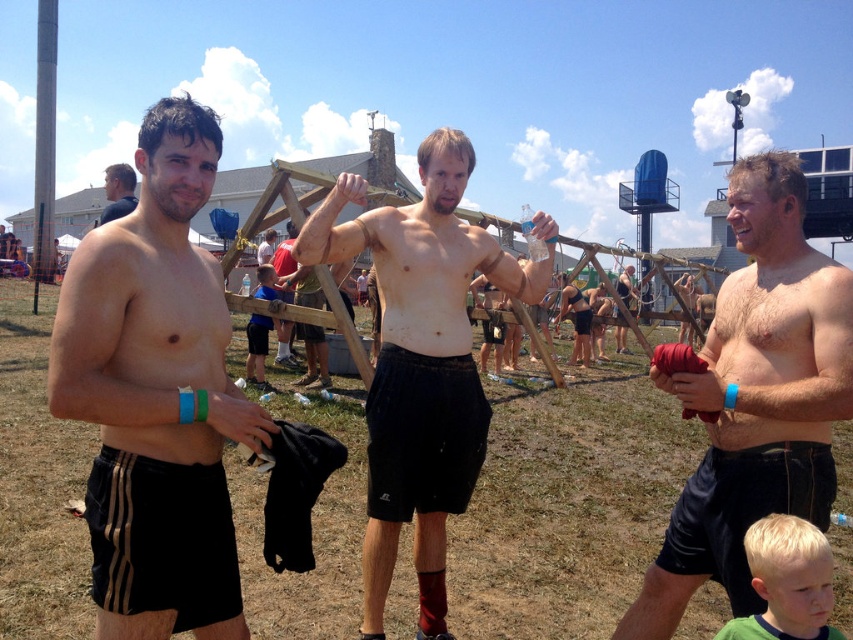
Can you confirm if smooth skin torso at center is shorter than blue t-shirt at center?

In fact, smooth skin torso at center may be taller than blue t-shirt at center.

Does point (378, 467) come farther from viewer compared to point (248, 317)?

No, it is not.

I want to click on smooth skin torso at center, so click(x=422, y=362).

The image size is (853, 640). Describe the element at coordinates (422, 362) in the screenshot. I see `smooth skin torso at center` at that location.

Locate an element on the screen. smooth skin torso at center is located at coordinates (422, 362).

Image resolution: width=853 pixels, height=640 pixels. I want to click on smooth skin torso at center, so click(422, 362).

In the scene shown: Is matte black shorts at left bigger than matte black shorts at center?

Indeed, matte black shorts at left has a larger size compared to matte black shorts at center.

Is matte black shorts at left taller than matte black shorts at center?

Indeed, matte black shorts at left has a greater height compared to matte black shorts at center.

Does point (126, 202) come closer to viewer compared to point (624, 300)?

Yes.

At what (x,y) coordinates should I click in order to perform the action: click on matte black shorts at left. Please return your answer as a coordinate pair (x, y). Looking at the image, I should click on (119, 192).